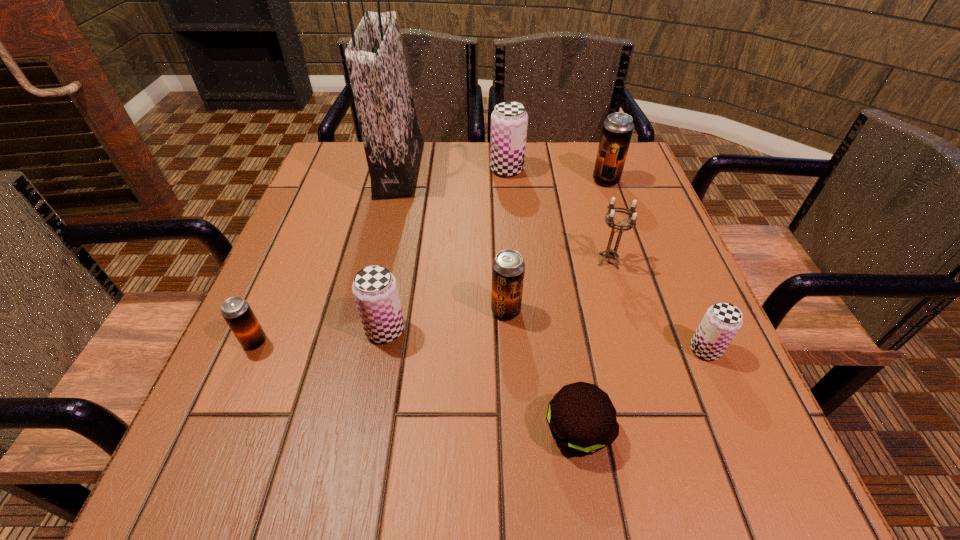
You are a GUI agent. You are given a task and a screenshot of the screen. Output one action in this format:
    pyautogui.click(x=<x>, y=<y>)
    Task: Click on the vacant space located 0.300m on the right of the leftmost purple beer can
    
    Given the screenshot: What is the action you would take?
    (575, 330)

This screenshot has width=960, height=540. I want to click on blank space located 0.150m on the back of the second farthest black beer can, so click(502, 246).

Locate an element on the screen. vacant area situated 0.210m on the left of the rightmost beer can is located at coordinates (566, 349).

Identify the location of vacant point located 0.190m on the back of the leftmost beer can. The image size is (960, 540). (291, 258).

Where is `vacant space situated on the right of the shortest object`? The image size is (960, 540). vacant space situated on the right of the shortest object is located at coordinates (720, 430).

Locate an element on the screen. The height and width of the screenshot is (540, 960). shopping bag that is at the far edge is located at coordinates (393, 144).

Where is `object at the near edge`? object at the near edge is located at coordinates (582, 419).

Locate an element on the screen. The width and height of the screenshot is (960, 540). shopping bag that is at the left edge is located at coordinates (393, 144).

I want to click on beer can that is at the left edge, so click(239, 316).

The width and height of the screenshot is (960, 540). I want to click on candle holder present at the right edge, so click(609, 253).